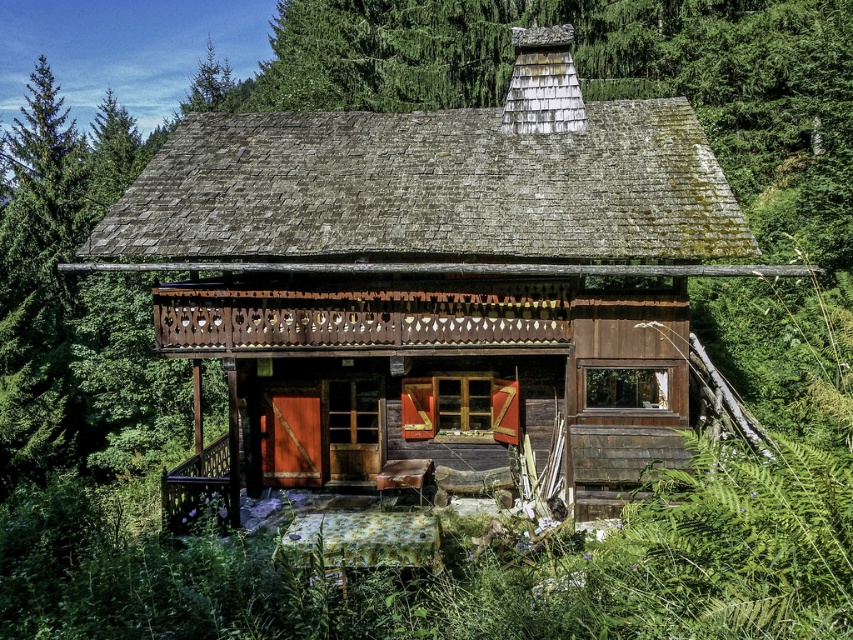
Question: Which point appears closest to the camera in this image?

Choices:
 (A) (532, 480)
 (B) (245, 371)

Answer: (A)

Question: Does rustic wooden cabin at center have a larger size compared to wooden porch at center?

Choices:
 (A) no
 (B) yes

Answer: (B)

Question: Which of the following is the closest to the observer?

Choices:
 (A) rustic wooden cabin at center
 (B) wooden porch at center

Answer: (B)

Question: In this image, where is rustic wooden cabin at center located relative to wooden porch at center?

Choices:
 (A) above
 (B) below

Answer: (A)

Question: Is rustic wooden cabin at center to the left of wooden porch at center from the viewer's perspective?

Choices:
 (A) no
 (B) yes

Answer: (A)